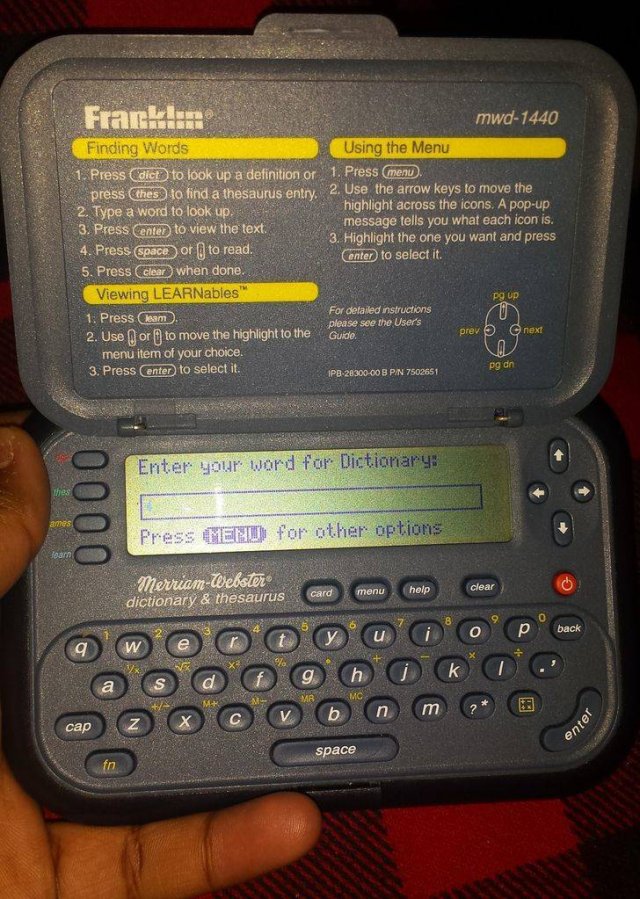
What are the coordinates of `lcd screen` in the screenshot? It's located at (461, 464).